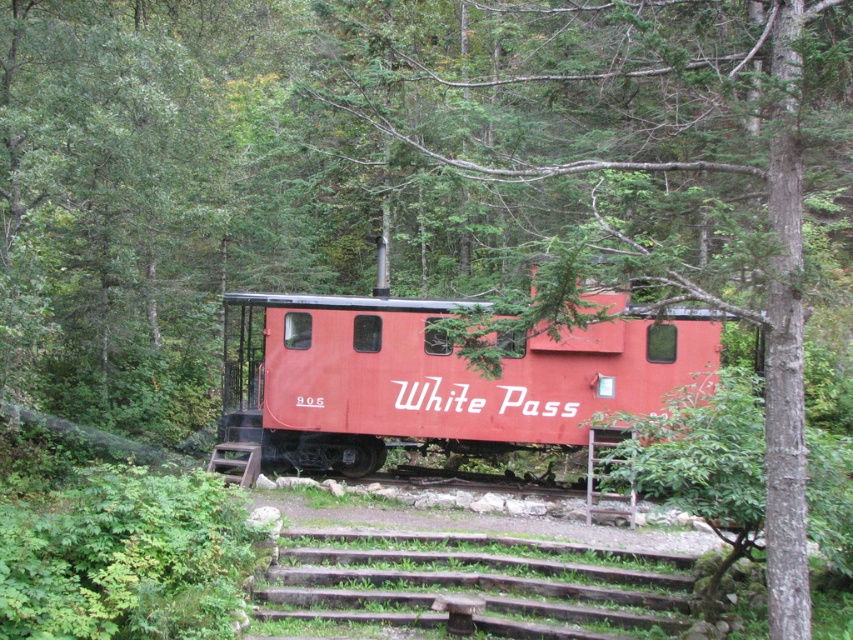
Question: Does green leafy tree at center come behind matte red caboose at center?

Choices:
 (A) yes
 (B) no

Answer: (B)

Question: Which point is closer to the camera taking this photo?

Choices:
 (A) (302, 349)
 (B) (577, 221)

Answer: (A)

Question: Is green leafy tree at center positioned at the back of matte red caboose at center?

Choices:
 (A) yes
 (B) no

Answer: (B)

Question: Among these points, which one is farthest from the camera?

Choices:
 (A) (282, 397)
 (B) (721, 218)

Answer: (A)

Question: Is green leafy tree at center below matte red caboose at center?

Choices:
 (A) no
 (B) yes

Answer: (A)